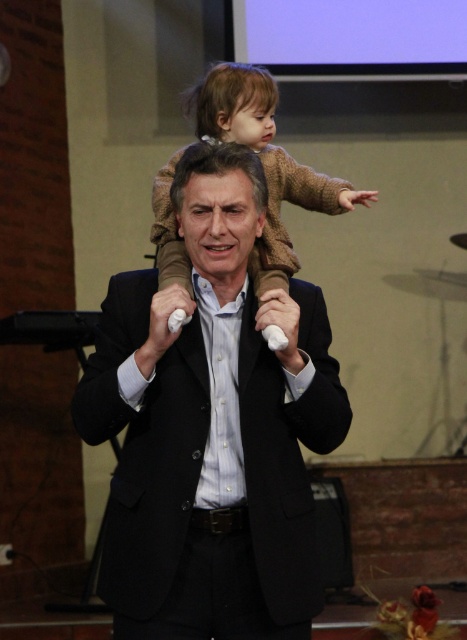
Based on the photo, is matte black suit at center positioned behind light brown wool sweater at upper center?

No.

Between matte black suit at center and light brown wool sweater at upper center, which one is positioned higher?

light brown wool sweater at upper center is above.

The width and height of the screenshot is (467, 640). Find the location of `matte black suit at center`. matte black suit at center is located at coordinates (212, 428).

At what (x,y) coordinates should I click in order to perform the action: click on matte black suit at center. Please return your answer as a coordinate pair (x, y). The height and width of the screenshot is (640, 467). Looking at the image, I should click on (212, 428).